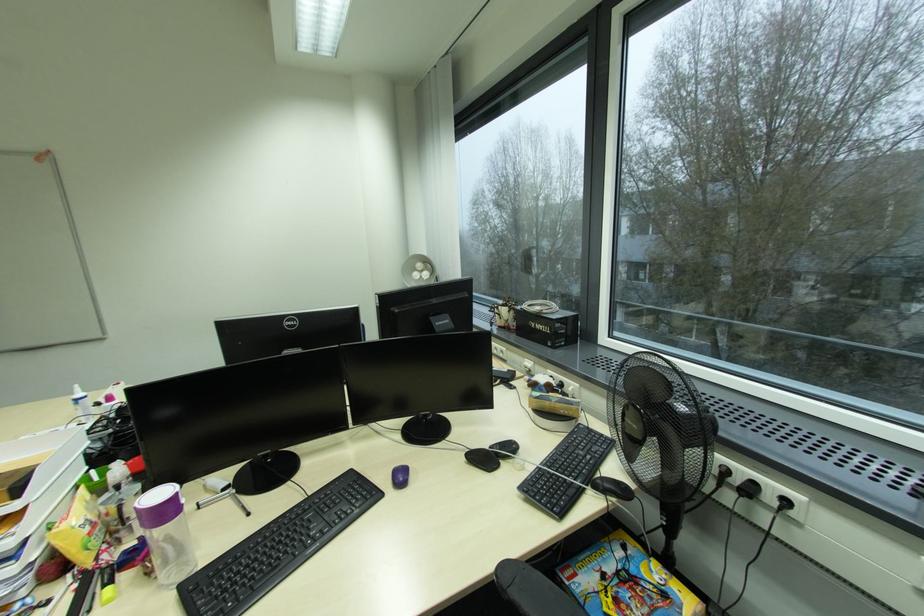
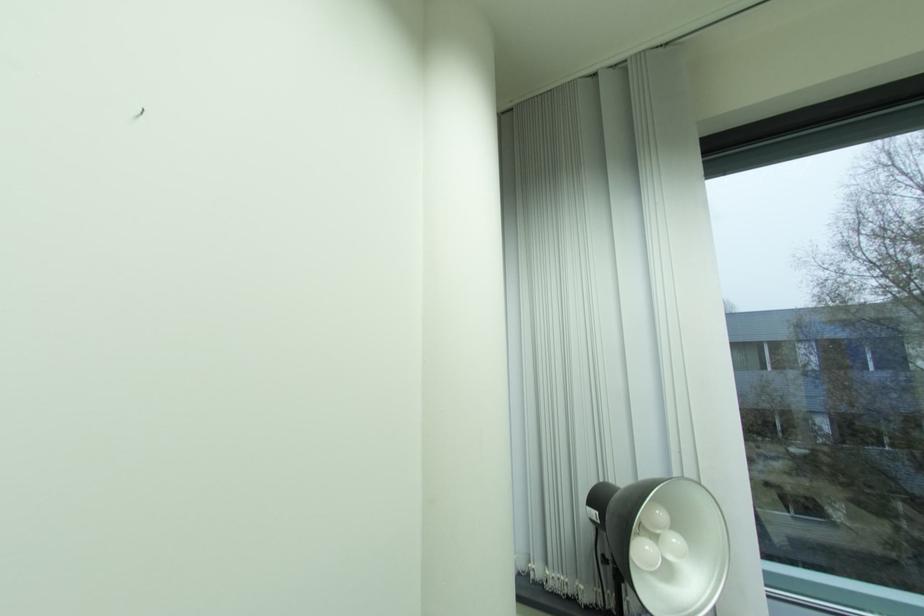
Find the pixel in the second image that matches point 428,270 in the first image.

(665, 531)